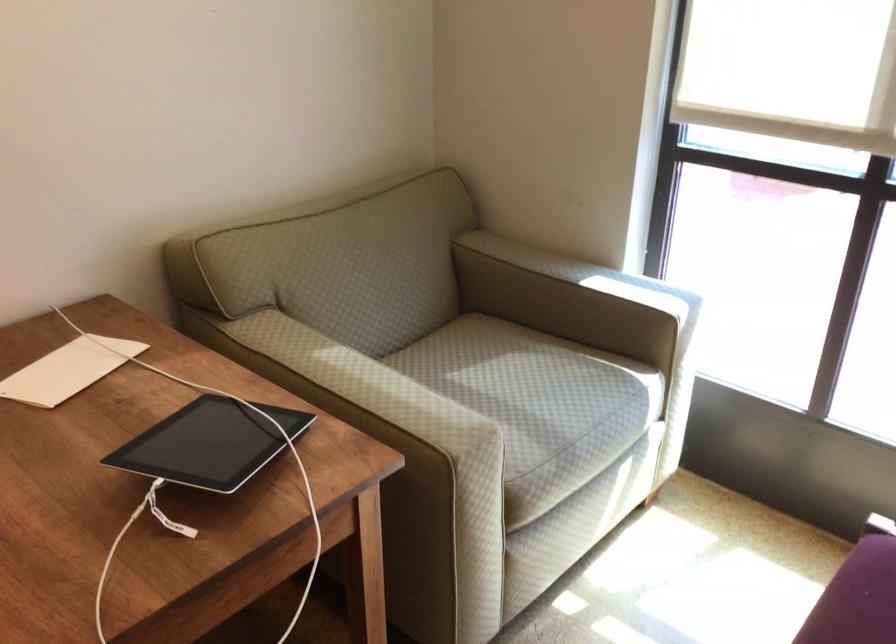
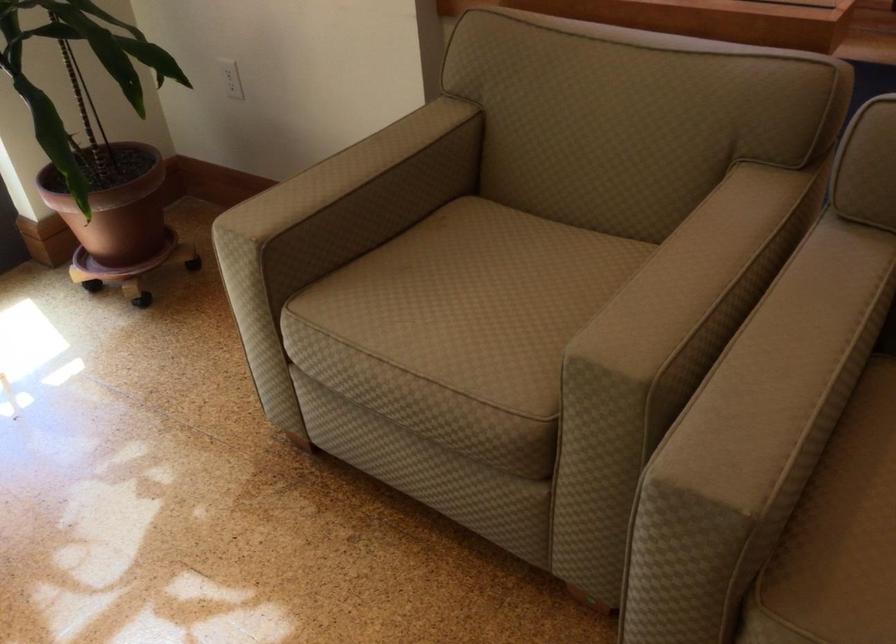
The images are taken continuously from a first-person perspective. In which direction is your viewpoint rotating?

The camera's rotation is toward right-down.